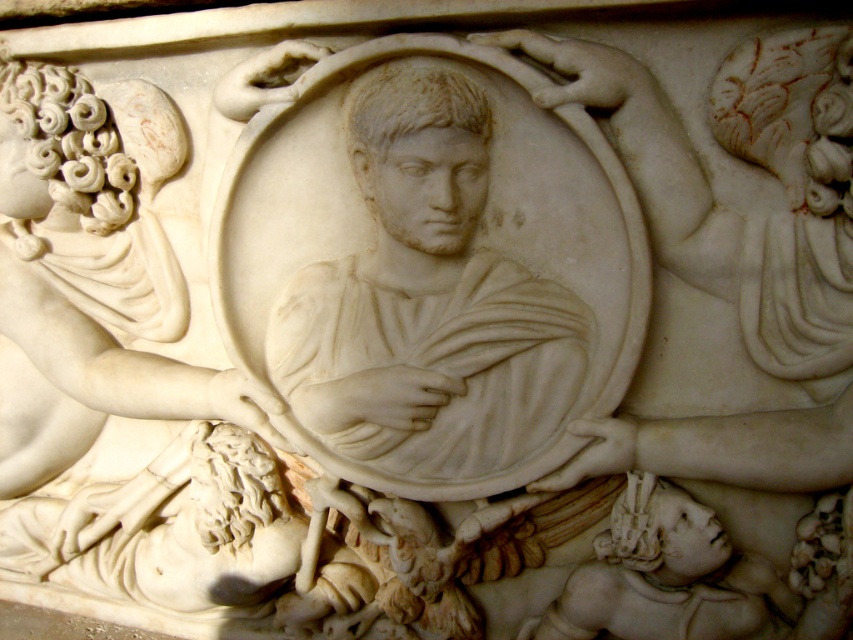
Question: Which object is closer to the camera taking this photo?

Choices:
 (A) white marble deity at center
 (B) white marble bust at center

Answer: (B)

Question: Among these objects, which one is farthest from the camera?

Choices:
 (A) white marble bust at center
 (B) white marble deity at center

Answer: (B)

Question: Does white marble bust at center have a smaller size compared to white marble deity at center?

Choices:
 (A) no
 (B) yes

Answer: (B)

Question: Does white marble bust at center appear over white marble deity at center?

Choices:
 (A) no
 (B) yes

Answer: (B)

Question: Which object appears closest to the camera in this image?

Choices:
 (A) white marble deity at center
 (B) white marble bust at center

Answer: (B)

Question: Is white marble bust at center further to the viewer compared to white marble deity at center?

Choices:
 (A) yes
 (B) no

Answer: (B)